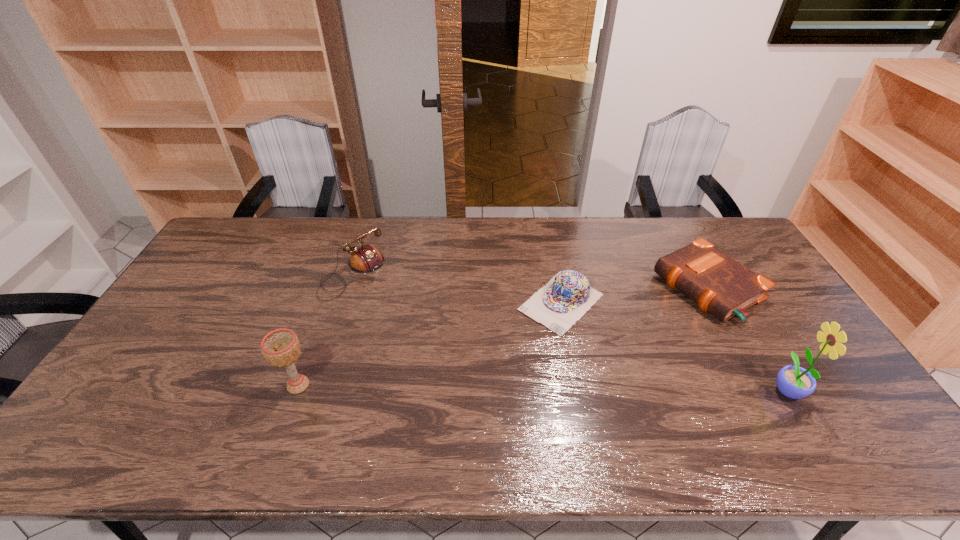
At what (x,y) coordinates should I click in order to perform the action: click on vacant spot on the desktop that is between the chalice and the tallest object and is positioned on the spine side of the Bible. Please return your answer as a coordinate pair (x, y). The height and width of the screenshot is (540, 960). Looking at the image, I should click on 518,387.

Image resolution: width=960 pixels, height=540 pixels. I want to click on free space on the desktop that is between the fourth shortest object and the tallest object and is positioned on the rotary dial of the telephone, so click(x=490, y=387).

The image size is (960, 540). In order to click on vacant space on the desktop that is between the fourth shortest object and the tallest object and is positioned on the front, side, and top of the cap in this screenshot , I will do `click(472, 387)`.